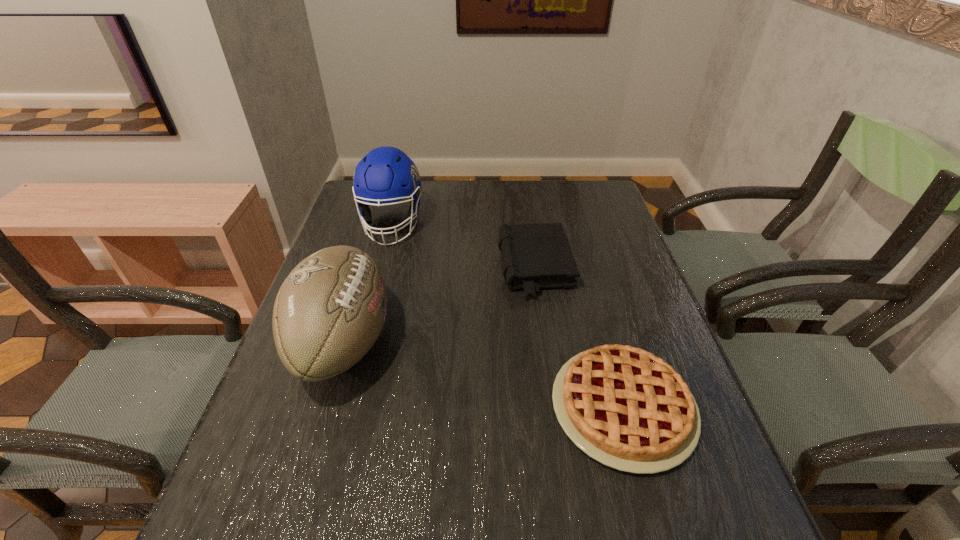
Locate an element on the screen. This screenshot has height=540, width=960. free space that satisfies the following two spatial constraints: 1. on the front-facing side of the football helmet; 2. on the laces of the football (American) is located at coordinates (361, 342).

This screenshot has height=540, width=960. Identify the location of vacant space that satisfies the following two spatial constraints: 1. on the laces of the football (American); 2. on the left side of the shortest object. (324, 407).

In order to click on free point that satisfies the following two spatial constraints: 1. on the front-facing side of the football helmet; 2. on the laces of the football (American) in this screenshot , I will do `click(361, 342)`.

Locate an element on the screen. The height and width of the screenshot is (540, 960). free spot that satisfies the following two spatial constraints: 1. on the front-facing side of the shortest object; 2. on the left side of the football helmet is located at coordinates point(344,407).

This screenshot has height=540, width=960. I want to click on vacant position in the image that satisfies the following two spatial constraints: 1. on the front-facing side of the third tallest object; 2. on the right side of the football helmet, so click(380, 268).

Locate an element on the screen. vacant point that satisfies the following two spatial constraints: 1. on the front-facing side of the football helmet; 2. on the left side of the Bible is located at coordinates (380, 268).

I want to click on free location that satisfies the following two spatial constraints: 1. on the front-facing side of the Bible; 2. on the right side of the football helmet, so click(x=380, y=268).